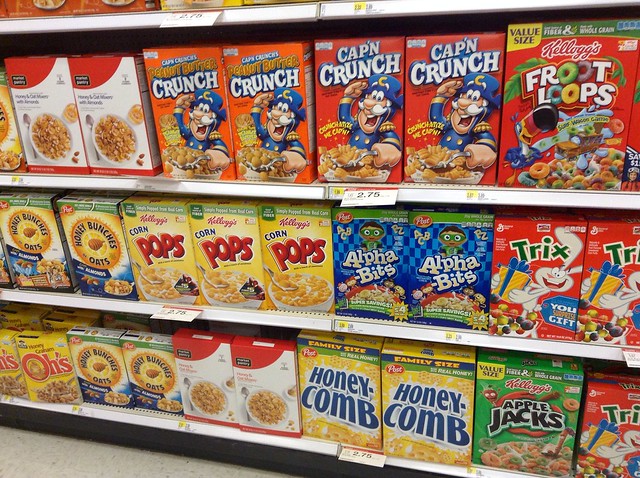
The height and width of the screenshot is (478, 640). Find the location of `shelf below cereal`. shelf below cereal is located at coordinates (129, 18), (137, 177), (125, 305), (124, 412).